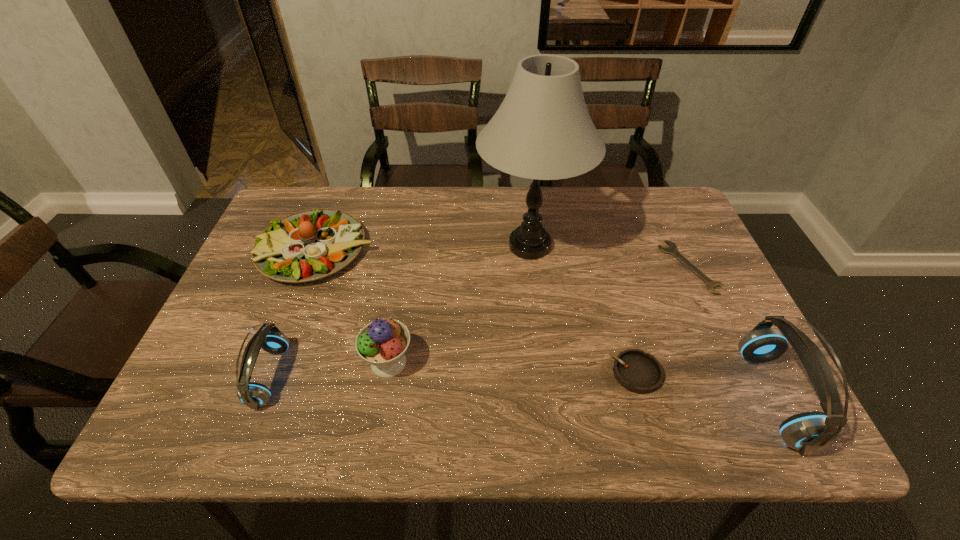
Find the location of a particular element. The width and height of the screenshot is (960, 540). the left headset is located at coordinates (252, 394).

Where is `the right headset`? the right headset is located at coordinates (810, 432).

Where is `the second tallest object`? Image resolution: width=960 pixels, height=540 pixels. the second tallest object is located at coordinates (810, 432).

At what (x,y) coordinates should I click in order to perform the action: click on the tallest object. Please return your answer as a coordinate pair (x, y). Looking at the image, I should click on (542, 130).

You are a GUI agent. You are given a task and a screenshot of the screen. Output one action in this format:
    pyautogui.click(x=<x>, y=<y>)
    Task: Click on the wrench
    
    Given the screenshot: What is the action you would take?
    pyautogui.click(x=672, y=249)

What are the coordinates of `salad plate` in the screenshot? It's located at (312, 244).

At what (x,y) coordinates should I click in order to perform the action: click on the fifth object from right to left. Please return your answer as a coordinate pair (x, y). Looking at the image, I should click on [382, 343].

The height and width of the screenshot is (540, 960). What are the coordinates of `ashtray` in the screenshot? It's located at click(x=639, y=372).

Identify the location of vacant space located 0.100m on the ear cups of the left headset. The image size is (960, 540). (209, 376).

You are a GUI agent. You are given a task and a screenshot of the screen. Output one action in this format:
    pyautogui.click(x=<x>, y=<y>)
    Task: Click on the free space located 0.290m on the right of the tallest object
    Image resolution: width=960 pixels, height=540 pixels.
    Given the screenshot: What is the action you would take?
    pyautogui.click(x=687, y=246)